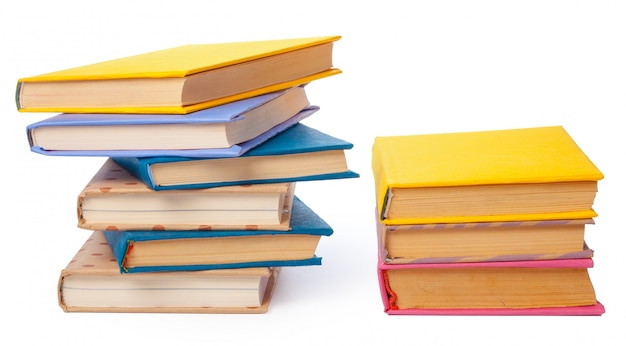
You are a GUI agent. You are given a task and a screenshot of the screen. Output one action in this format:
    pyautogui.click(x=<x>, y=<y>)
    Task: Click on the books
    Image resolution: width=626 pixels, height=346 pixels.
    Given the screenshot: What is the action you would take?
    pyautogui.click(x=185, y=93), pyautogui.click(x=197, y=140), pyautogui.click(x=196, y=172), pyautogui.click(x=178, y=220), pyautogui.click(x=175, y=248), pyautogui.click(x=178, y=288), pyautogui.click(x=476, y=182), pyautogui.click(x=476, y=238), pyautogui.click(x=483, y=290)